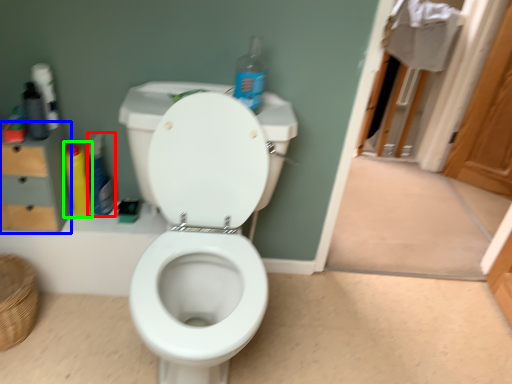
Question: Which object is the farthest from cleaning product (highlighted by a red box)? Choose among these: dresser (highlighted by a blue box) or cleaning product (highlighted by a green box).

Choices:
 (A) dresser
 (B) cleaning product

Answer: (A)